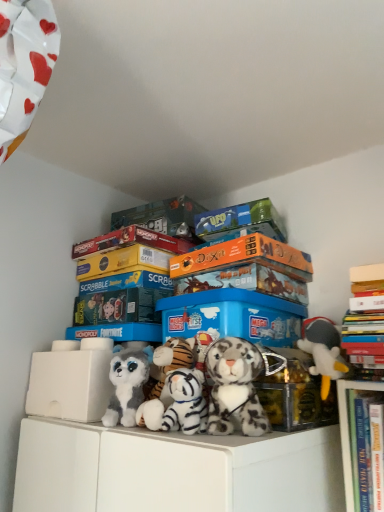
Question: Is gray plush toy at right, the fourth toy positioned from the left, taller or shorter than white plastic storage box at lower left, placed as the fourth storage box when sorted from right to left?

Choices:
 (A) tall
 (B) short

Answer: (B)

Question: Is gray plush toy at right, which is the 1th toy from right to left, spatially inside white plastic storage box at lower left, placed as the fourth storage box when sorted from right to left, or outside of it?

Choices:
 (A) inside
 (B) outside

Answer: (B)

Question: Which is farther from the blue plastic storage box at center, which is counted as the second storage box, starting from the right?

Choices:
 (A) white plush tiger at center, which is counted as the 3th toy, starting from the right
 (B) hardcover books at upper right
 (C) orange matte board game at upper center, the second book positioned from the right
 (D) hardcover books at upper right, placed as the 1th book when sorted from right to left
 (E) gray plush toy at right, the fourth toy positioned from the left

Answer: (B)

Question: Which is nearer to the matt orange board game at upper center, which is the third book in right-to-left order?

Choices:
 (A) metallic gold storage box at center, which is the 1th storage box from right to left
 (B) fluffy white and gray plush toy at center, which appears as the first toy when viewed from the left
 (C) fluffy white tiger at center, which is counted as the 2th toy, starting from the right
 (D) white plastic storage box at lower left, placed as the fourth storage box when sorted from right to left
 (E) hardcover books at upper right, which is the 3th book in left-to-right order

Answer: (D)